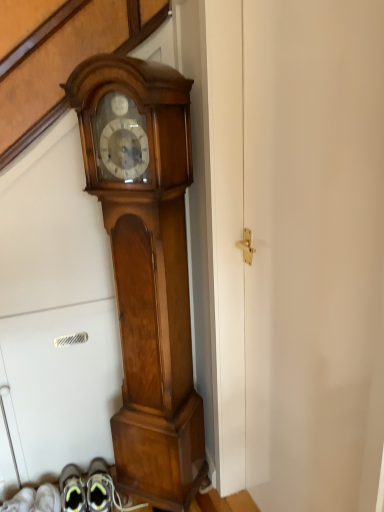
Question: From a real-world perspective, is polished wood grandfather clock at center above or below white matte door at center?

Choices:
 (A) below
 (B) above

Answer: (A)

Question: Would you say polished wood grandfather clock at center is inside or outside white matte door at center?

Choices:
 (A) inside
 (B) outside

Answer: (B)

Question: Looking at their shapes, would you say polished wood grandfather clock at center is wider or thinner than white matte door at center?

Choices:
 (A) thin
 (B) wide

Answer: (B)

Question: From the image's perspective, is white matte door at center located above or below polished wood grandfather clock at center?

Choices:
 (A) below
 (B) above

Answer: (A)

Question: In terms of size, does white matte door at center appear bigger or smaller than polished wood grandfather clock at center?

Choices:
 (A) small
 (B) big

Answer: (B)

Question: Is point (357, 238) positioned closer to the camera than point (185, 117)?

Choices:
 (A) farther
 (B) closer

Answer: (B)

Question: From a real-world perspective, relative to polished wood grandfather clock at center, is white matte door at center vertically above or below?

Choices:
 (A) above
 (B) below

Answer: (A)